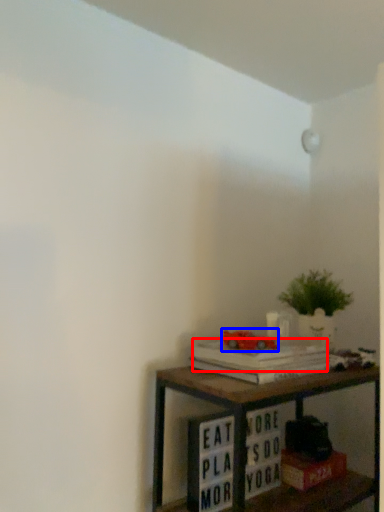
Question: Which of the following is the farthest to the observer, paperback book (highlighted by a red box) or toy (highlighted by a blue box)?

Choices:
 (A) paperback book
 (B) toy

Answer: (B)